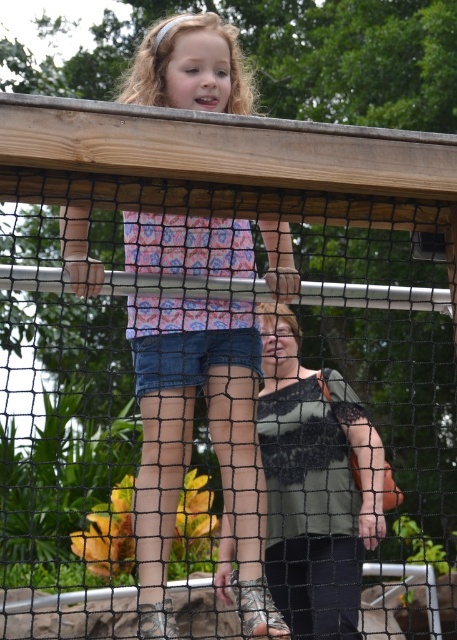
Who is more distant from viewer, [291,250] or [323,508]?

Positioned behind is point [323,508].

Can you confirm if matte pink shirt at upper center is taller than green lace tank top at center?

Incorrect, matte pink shirt at upper center's height is not larger of green lace tank top at center's.

Is point (143, 616) positioned behind point (306, 484)?

No, (143, 616) is in front of (306, 484).

The width and height of the screenshot is (457, 640). What are the coordinates of `matte pink shirt at upper center` in the screenshot? It's located at (191, 444).